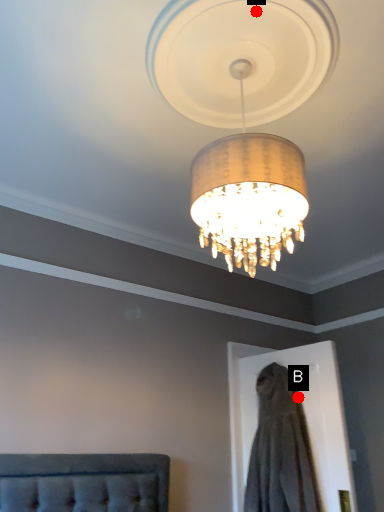
Question: Two points are circled on the image, labeled by A and B beside each circle. Which point is farther from the camera taking this photo?

Choices:
 (A) A is further
 (B) B is further

Answer: (B)